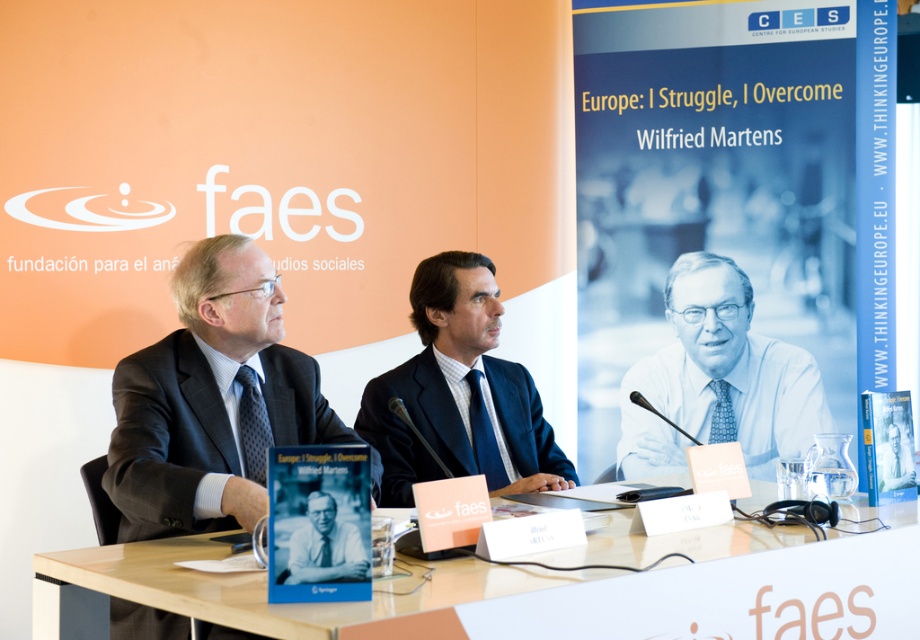
Based on the photo, who is higher up, light blue tie at center or matte black book at center?

light blue tie at center

At what (x,y) coordinates should I click in order to perform the action: click on light blue tie at center. Please return your answer as a coordinate pair (x, y). The height and width of the screenshot is (640, 920). Looking at the image, I should click on (719, 380).

Does point (199, 493) come farther from viewer compared to point (487, 339)?

No, (199, 493) is closer to viewer.

Can you confirm if dark gray suit at left is positioned to the right of dark blue suit at center?

Incorrect, dark gray suit at left is not on the right side of dark blue suit at center.

Locate an element on the screen. The height and width of the screenshot is (640, 920). dark gray suit at left is located at coordinates tap(211, 401).

Where is `dark gray suit at left`? dark gray suit at left is located at coordinates (211, 401).

Is dark gray suit at left in front of matte black book at center?

That is False.

Is dark gray suit at left bigger than matte black book at center?

Correct, dark gray suit at left is larger in size than matte black book at center.

Between point (184, 528) and point (306, 579), which one is positioned in front?

Point (306, 579) is in front.

The image size is (920, 640). I want to click on dark gray suit at left, so click(211, 401).